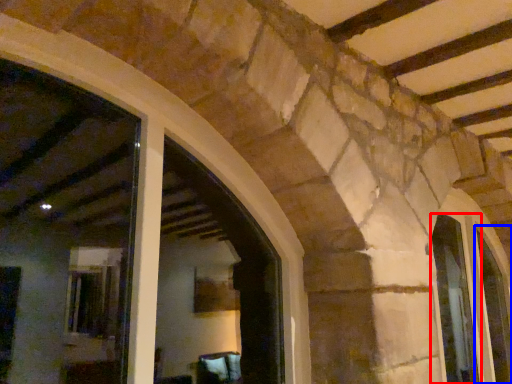
Question: Among these objects, which one is farthest to the camera, window (highlighted by a red box) or window (highlighted by a blue box)?

Choices:
 (A) window
 (B) window

Answer: (B)